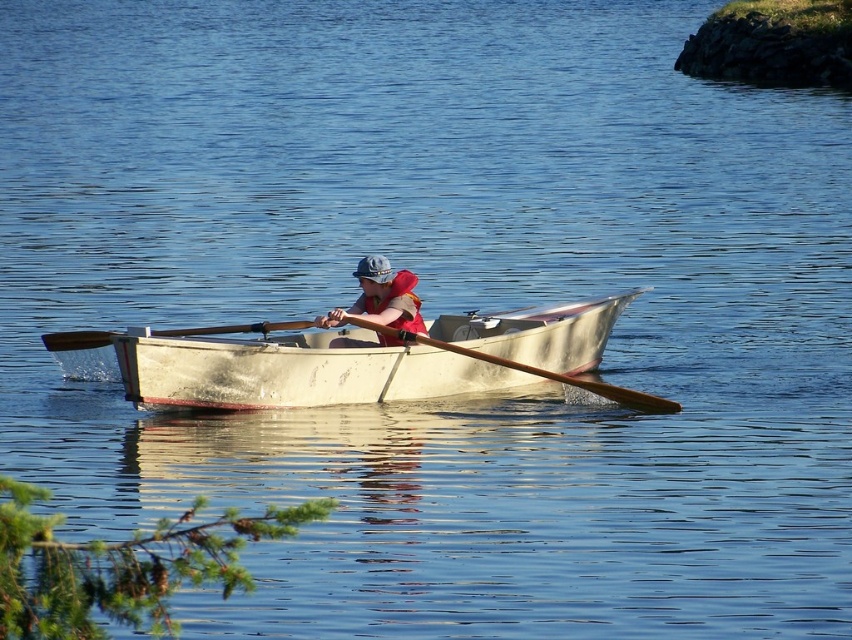
Question: Is wooden at center to the left of brown wooden paddle at center from the viewer's perspective?

Choices:
 (A) no
 (B) yes

Answer: (A)

Question: Based on their relative distances, which object is nearer to the brown wooden paddle at center?

Choices:
 (A) matte red life vest at center
 (B) red matte life jacket at center
 (C) wooden at center

Answer: (A)

Question: Is white weathered boat at center wider than red matte life jacket at center?

Choices:
 (A) yes
 (B) no

Answer: (A)

Question: Which object is positioned farthest from the matte red life vest at center?

Choices:
 (A) white weathered boat at center
 (B) wooden at center

Answer: (A)

Question: Considering the real-world distances, which object is closest to the red matte life jacket at center?

Choices:
 (A) white weathered boat at center
 (B) matte red life vest at center

Answer: (B)

Question: Does matte red life vest at center appear under brown wooden paddle at center?

Choices:
 (A) yes
 (B) no

Answer: (B)